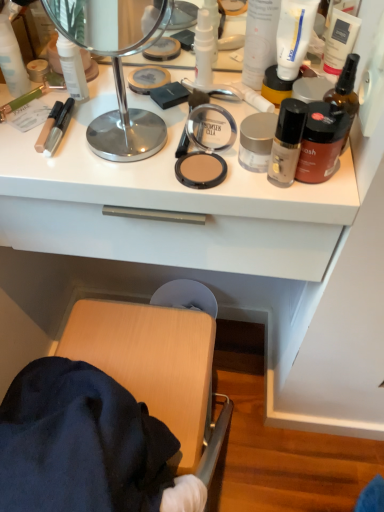
Where is `vacant space behind matte brown compact at center`? vacant space behind matte brown compact at center is located at coordinates click(x=164, y=103).